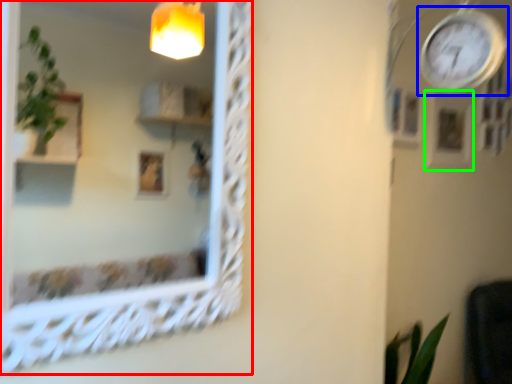
Question: Which is nearer to the mirror (highlighted by a red box)? clock (highlighted by a blue box) or picture frame (highlighted by a green box).

Choices:
 (A) clock
 (B) picture frame

Answer: (A)